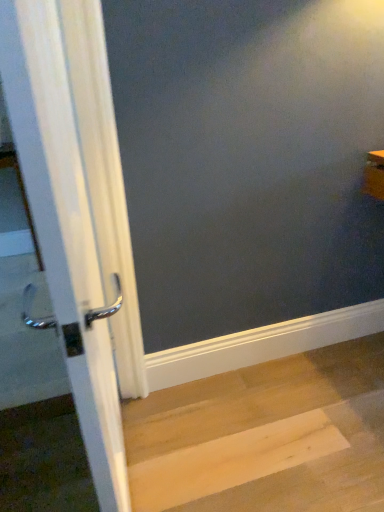
At what (x,y) coordinates should I click in order to perform the action: click on free region on the left part of white glossy door handle at left. Please return your answer as a coordinate pair (x, y). The image size is (384, 512). Looking at the image, I should click on (50, 471).